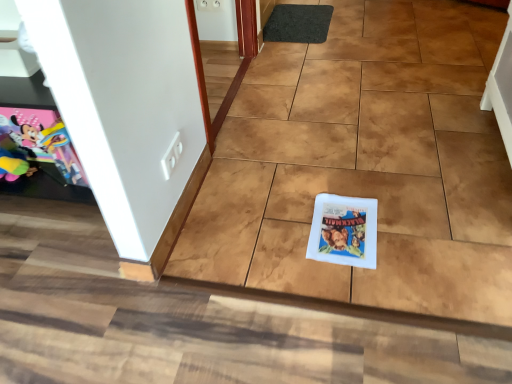
Question: From the image's perspective, relative to matte paper comic book at left, which ranks as the second comic book in bottom-to-top order, is black rubber doormat at upper center above or below?

Choices:
 (A) above
 (B) below

Answer: (A)

Question: Considering the positions of black rubber doormat at upper center and matte paper comic book at left, which is the 1th comic book from top to bottom, in the image, is black rubber doormat at upper center wider or thinner than matte paper comic book at left, which is the 1th comic book from top to bottom,?

Choices:
 (A) wide
 (B) thin

Answer: (A)

Question: Which object is positioned farthest from the black rubber doormat at upper center?

Choices:
 (A) matte paper comic book at left, which ranks as the second comic book in bottom-to-top order
 (B) white paper comic book at center, which is the second comic book from top to bottom

Answer: (A)

Question: Considering the real-world distances, which object is closest to the black rubber doormat at upper center?

Choices:
 (A) matte paper comic book at left, which is the 1th comic book from top to bottom
 (B) white paper comic book at center, which is the second comic book from top to bottom

Answer: (B)